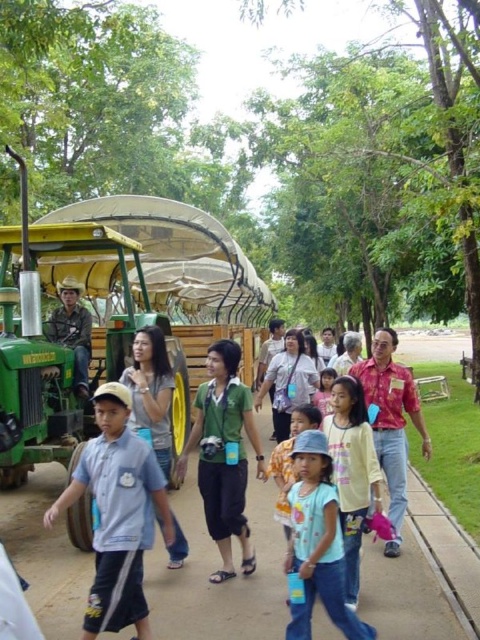
You are a photographer trying to capture a clear shot of the green matte shirt at center and the light blue cotton shirt at center. Which one is blocking the view of the other?

The green matte shirt at center is positioned over the light blue cotton shirt at center, so it is blocking the view of the latter.

You are a photographer trying to capture a candid shot of the blue cotton shirt at center and the light blue denim jeans at center. Since you want to focus on the clothing items, you need to adjust your camera to ensure both are in frame. Given their positions, which clothing item is taller and would require you to adjust the camera angle upwards to include its full height?

The light blue denim jeans at center has a greater height compared to the blue cotton shirt at center, so you would need to adjust the camera angle upwards to include the full height of the light blue denim jeans at center.